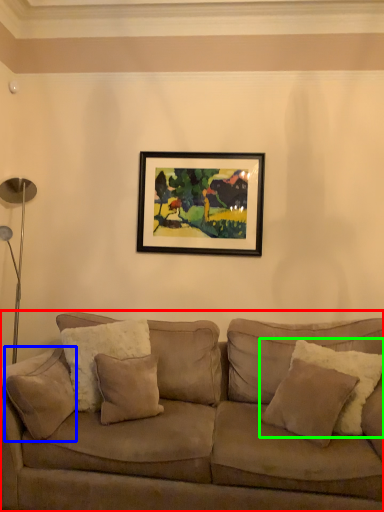
Question: Considering the real-world distances, which object is farthest from studio couch (highlighted by a red box)? pillow (highlighted by a blue box) or pillow (highlighted by a green box)?

Choices:
 (A) pillow
 (B) pillow

Answer: (A)